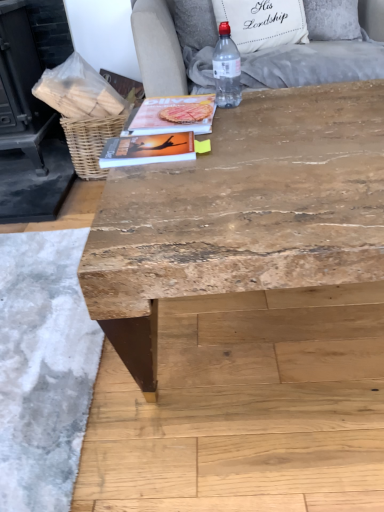
The width and height of the screenshot is (384, 512). What do you see at coordinates (262, 22) in the screenshot? I see `white fabric pillow at upper center` at bounding box center [262, 22].

This screenshot has height=512, width=384. What do you see at coordinates (172, 115) in the screenshot? I see `matte paper magazine at center, marked as the first magazine in a top-to-bottom arrangement` at bounding box center [172, 115].

How much space does matte paper magazine at center, marked as the first magazine in a top-to-bottom arrangement, occupy vertically?

0.93 inches.

What do you see at coordinates (253, 47) in the screenshot?
I see `light gray fabric armchair at upper center` at bounding box center [253, 47].

Image resolution: width=384 pixels, height=512 pixels. In order to click on white fabric pillow at upper center in this screenshot , I will do `click(262, 22)`.

Is woven brown basket at upper left situated inside white fabric pillow at upper center or outside?

woven brown basket at upper left is not inside white fabric pillow at upper center, it's outside.

Are woven brown basket at upper left and white fabric pillow at upper center beside each other?

No, woven brown basket at upper left is not beside white fabric pillow at upper center.

From a real-world perspective, is woven brown basket at upper left on white fabric pillow at upper center?

No, from a real-world perspective, woven brown basket at upper left is not over white fabric pillow at upper center

Between woven brown basket at upper left and white fabric pillow at upper center, which one has larger size?

Bigger between the two is woven brown basket at upper left.

Is woven brown basket at upper left taller than light gray fabric armchair at upper center?

No.

How many degrees apart are the facing directions of woven brown basket at upper left and light gray fabric armchair at upper center?

They differ by 0.617 degrees in their facing directions.

Considering the sizes of objects woven brown basket at upper left and light gray fabric armchair at upper center in the image provided, who is bigger, woven brown basket at upper left or light gray fabric armchair at upper center?

Bigger between the two is light gray fabric armchair at upper center.

From a real-world perspective, is woven brown basket at upper left positioned under light gray fabric armchair at upper center based on gravity?

Indeed, from a real-world perspective, woven brown basket at upper left is positioned beneath light gray fabric armchair at upper center.

From a real-world perspective, relative to matte paper magazine at center, positioned as the first magazine in back-to-front order, is natural wood table at center vertically above or below?

natural wood table at center is situated lower than matte paper magazine at center, positioned as the first magazine in back-to-front order, in the real world.

Locate an element on the screen. the 2nd magazine behind the natural wood table at center is located at coordinates (172, 115).

Considering the sizes of objects natural wood table at center and matte paper magazine at center, positioned as the first magazine in back-to-front order, in the image provided, who is wider, natural wood table at center or matte paper magazine at center, positioned as the first magazine in back-to-front order,?

Wider between the two is natural wood table at center.

Is the depth of natural wood table at center less than that of matte paper magazine at center, placed as the second magazine when sorted from bottom to top?

Yes.

Which is behind, natural wood table at center or clear plastic bottle at upper center?

Positioned behind is clear plastic bottle at upper center.

Looking at this image, is natural wood table at center to the left of clear plastic bottle at upper center from the viewer's perspective?

In fact, natural wood table at center is to the right of clear plastic bottle at upper center.

At what (x,y) coordinates should I click in order to perform the action: click on table that is in front of the clear plastic bottle at upper center. Please return your answer as a coordinate pair (x, y). Looking at the image, I should click on (242, 213).

From a real-world perspective, between natural wood table at center and clear plastic bottle at upper center, who is vertically higher?

clear plastic bottle at upper center is physically above.

Considering the relative sizes of natural wood table at center and white fabric pillow at upper center in the image provided, is natural wood table at center bigger than white fabric pillow at upper center?

Correct, natural wood table at center is larger in size than white fabric pillow at upper center.

Is natural wood table at center inside or outside of white fabric pillow at upper center?

natural wood table at center is located beyond the bounds of white fabric pillow at upper center.

Is white fabric pillow at upper center taller or shorter than natural wood table at center?

Considering their sizes, white fabric pillow at upper center has less height than natural wood table at center.

Which point is more forward, (x=269, y=0) or (x=269, y=145)?

The point (x=269, y=145) is in front.

Is white fabric pillow at upper center closer to the viewer compared to natural wood table at center?

No, white fabric pillow at upper center is further to the viewer.

Can you tell me how much clear plastic bottle at upper center and matte orange book at center, which is the 2th magazine from top to bottom, differ in facing direction?

They differ by 91.9 degrees in their facing directions.

From the image's perspective, which one is positioned lower, clear plastic bottle at upper center or matte orange book at center, the first magazine positioned from the bottom?

From the image's view, matte orange book at center, the first magazine positioned from the bottom, is below.

Does point (216, 86) appear closer or farther from the camera than point (124, 159)?

Clearly, point (216, 86) is more distant from the camera than point (124, 159).

Considering the sizes of clear plastic bottle at upper center and matte orange book at center, which appears as the 1th magazine when viewed from the front, in the image, is clear plastic bottle at upper center bigger or smaller than matte orange book at center, which appears as the 1th magazine when viewed from the front,?

In the image, clear plastic bottle at upper center appears to be larger than matte orange book at center, which appears as the 1th magazine when viewed from the front.

Find the location of a particular element. Image resolution: width=384 pixels, height=512 pixels. basket that appears on the left of white fabric pillow at upper center is located at coordinates (91, 141).

Where is `basket that is under the light gray fabric armchair at upper center (from a real-world perspective)`? This screenshot has width=384, height=512. basket that is under the light gray fabric armchair at upper center (from a real-world perspective) is located at coordinates (91, 141).

Considering their positions, is matte orange book at center, which appears as the 1th magazine when viewed from the front, positioned further to natural wood table at center than woven brown basket at upper left?

The object further to natural wood table at center is woven brown basket at upper left.

When comparing their distances from clear plastic bottle at upper center, does woven brown basket at upper left or matte paper magazine at center, placed as the second magazine when sorted from bottom to top, seem closer?

Based on the image, matte paper magazine at center, placed as the second magazine when sorted from bottom to top, appears to be nearer to clear plastic bottle at upper center.

Looking at this image, which object lies further to the anchor point matte paper magazine at center, marked as the first magazine in a top-to-bottom arrangement, light gray fabric armchair at upper center or matte orange book at center, positioned as the 2th magazine in back-to-front order?

The object further to matte paper magazine at center, marked as the first magazine in a top-to-bottom arrangement, is light gray fabric armchair at upper center.

When comparing their distances from matte paper magazine at center, positioned as the first magazine in back-to-front order, does natural wood table at center or white fabric pillow at upper center seem further?

white fabric pillow at upper center is further to matte paper magazine at center, positioned as the first magazine in back-to-front order.

Looking at the image, which one is located closer to clear plastic bottle at upper center, white fabric pillow at upper center or woven brown basket at upper left?

woven brown basket at upper left.

Consider the image. Considering their positions, is natural wood table at center positioned closer to light gray fabric armchair at upper center than matte paper magazine at center, placed as the second magazine when sorted from bottom to top?

matte paper magazine at center, placed as the second magazine when sorted from bottom to top, is positioned closer to the anchor light gray fabric armchair at upper center.

From the image, which object appears to be nearer to white fabric pillow at upper center, clear plastic bottle at upper center or woven brown basket at upper left?

woven brown basket at upper left.

In the scene shown: When comparing their distances from white fabric pillow at upper center, does matte paper magazine at center, placed as the second magazine when sorted from bottom to top, or light gray fabric armchair at upper center seem closer?

light gray fabric armchair at upper center.

Identify the location of pillow located between woven brown basket at upper left and light gray fabric armchair at upper center in the left-right direction. [x=262, y=22].

Where is `bottle that lies between light gray fabric armchair at upper center and natural wood table at center from top to bottom`? The image size is (384, 512). bottle that lies between light gray fabric armchair at upper center and natural wood table at center from top to bottom is located at coordinates (226, 69).

The image size is (384, 512). In order to click on magazine located between matte orange book at center, which appears as the 1th magazine when viewed from the front, and woven brown basket at upper left in the depth direction in this screenshot , I will do `click(172, 115)`.

Locate an element on the screen. magazine between natural wood table at center and matte paper magazine at center, marked as the first magazine in a top-to-bottom arrangement, along the z-axis is located at coordinates point(147,150).